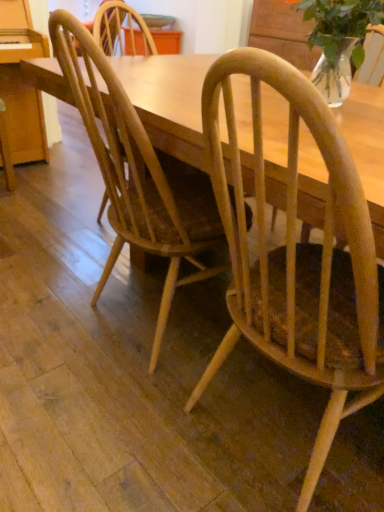
The width and height of the screenshot is (384, 512). Describe the element at coordinates (338, 41) in the screenshot. I see `clear glass vase at upper right` at that location.

I want to click on light brown wood chair at center, which is counted as the first chair, starting from the right, so click(x=298, y=256).

Consider the image. From a real-world perspective, is light brown wood chair at center, which appears as the 2th chair when viewed from the left, under natural wood chair at center, which is the 1th chair in left-to-right order?

Yes, from a real-world perspective, light brown wood chair at center, which appears as the 2th chair when viewed from the left, is under natural wood chair at center, which is the 1th chair in left-to-right order.

Where is `chair on the left of light brown wood chair at center, which appears as the 2th chair when viewed from the left`? chair on the left of light brown wood chair at center, which appears as the 2th chair when viewed from the left is located at coordinates (137, 175).

Between light brown wood chair at center, which is counted as the first chair, starting from the right, and natural wood chair at center, which is the 1th chair in left-to-right order, which one is positioned in front?

light brown wood chair at center, which is counted as the first chair, starting from the right.

From the image's perspective, is light brown wood chair at center, which is counted as the first chair, starting from the right, above or below natural wood chair at center, marked as the 2th chair in a right-to-left arrangement?

Based on their image positions, light brown wood chair at center, which is counted as the first chair, starting from the right, is located beneath natural wood chair at center, marked as the 2th chair in a right-to-left arrangement.

Does natural wood chair at center, marked as the 2th chair in a right-to-left arrangement, have a greater width compared to light brown wood chair at center, which is counted as the first chair, starting from the right?

No, natural wood chair at center, marked as the 2th chair in a right-to-left arrangement, is not wider than light brown wood chair at center, which is counted as the first chair, starting from the right.

From a real-world perspective, is natural wood chair at center, which is the 1th chair in left-to-right order, positioned under light brown wood chair at center, which appears as the 2th chair when viewed from the left, based on gravity?

No.

Is natural wood chair at center, marked as the 2th chair in a right-to-left arrangement, taller or shorter than light brown wood chair at center, which is counted as the first chair, starting from the right?

natural wood chair at center, marked as the 2th chair in a right-to-left arrangement, is shorter than light brown wood chair at center, which is counted as the first chair, starting from the right.

How many degrees apart are the facing directions of clear glass vase at upper right and light brown wood chair at center, which is counted as the first chair, starting from the right?

88.6 degrees separate the facing orientations of clear glass vase at upper right and light brown wood chair at center, which is counted as the first chair, starting from the right.

From the image's perspective, is clear glass vase at upper right below light brown wood chair at center, which appears as the 2th chair when viewed from the left?

No, from the image's perspective, clear glass vase at upper right is not below light brown wood chair at center, which appears as the 2th chair when viewed from the left.

Is clear glass vase at upper right placed right next to light brown wood chair at center, which is counted as the first chair, starting from the right?

No, clear glass vase at upper right is not with light brown wood chair at center, which is counted as the first chair, starting from the right.

Considering the relative sizes of clear glass vase at upper right and light brown wood chair at center, which appears as the 2th chair when viewed from the left, in the image provided, is clear glass vase at upper right taller than light brown wood chair at center, which appears as the 2th chair when viewed from the left,?

No.

Is light brown wood chair at center, which is counted as the first chair, starting from the right, next to clear glass vase at upper right and touching it?

light brown wood chair at center, which is counted as the first chair, starting from the right, and clear glass vase at upper right are not in contact.

Who is taller, light brown wood chair at center, which appears as the 2th chair when viewed from the left, or clear glass vase at upper right?

light brown wood chair at center, which appears as the 2th chair when viewed from the left.

Could you tell me if light brown wood chair at center, which appears as the 2th chair when viewed from the left, is turned towards clear glass vase at upper right?

No.

Does natural wood chair at center, which is the 1th chair in left-to-right order, have a lesser height compared to clear glass vase at upper right?

No, natural wood chair at center, which is the 1th chair in left-to-right order, is not shorter than clear glass vase at upper right.

In terms of size, does natural wood chair at center, which is the 1th chair in left-to-right order, appear bigger or smaller than clear glass vase at upper right?

In the image, natural wood chair at center, which is the 1th chair in left-to-right order, appears to be larger than clear glass vase at upper right.

From a real-world perspective, is natural wood chair at center, which is the 1th chair in left-to-right order, located higher than clear glass vase at upper right?

No, from a real-world perspective, natural wood chair at center, which is the 1th chair in left-to-right order, is not on top of clear glass vase at upper right.

Which point is more distant from viewer, (x=191, y=232) or (x=336, y=71)?

Point (x=191, y=232)

Can we say clear glass vase at upper right lies outside natural wood chair at center, which is the 1th chair in left-to-right order?

Answer: Indeed, clear glass vase at upper right is completely outside natural wood chair at center, which is the 1th chair in left-to-right order.

From the picture: Between clear glass vase at upper right and natural wood chair at center, which is the 1th chair in left-to-right order, which one is positioned behind?

clear glass vase at upper right is further away from the camera.

Is clear glass vase at upper right positioned far away from natural wood chair at center, marked as the 2th chair in a right-to-left arrangement?

Actually, clear glass vase at upper right and natural wood chair at center, marked as the 2th chair in a right-to-left arrangement, are a little close together.

From the image's perspective, which is above, clear glass vase at upper right or natural wood chair at center, which is the 1th chair in left-to-right order?

clear glass vase at upper right, from the image's perspective.

There is a light brown wood chair at center, which appears as the 2th chair when viewed from the left. Where is `chair above it (from a real-world perspective)`? chair above it (from a real-world perspective) is located at coordinates (137, 175).

Find the location of `chair that appears below the natural wood chair at center, marked as the 2th chair in a right-to-left arrangement (from the image's perspective)`. chair that appears below the natural wood chair at center, marked as the 2th chair in a right-to-left arrangement (from the image's perspective) is located at coordinates (298, 256).

Looking at the image, which one is located further to natural wood chair at center, marked as the 2th chair in a right-to-left arrangement, clear glass vase at upper right or light brown wood chair at center, which is counted as the first chair, starting from the right?

Based on the image, clear glass vase at upper right appears to be further to natural wood chair at center, marked as the 2th chair in a right-to-left arrangement.

When comparing their distances from clear glass vase at upper right, does natural wood chair at center, which is the 1th chair in left-to-right order, or light brown wood chair at center, which appears as the 2th chair when viewed from the left, seem further?

Among the two, natural wood chair at center, which is the 1th chair in left-to-right order, is located further to clear glass vase at upper right.

From the image, which object appears to be nearer to clear glass vase at upper right, light brown wood chair at center, which appears as the 2th chair when viewed from the left, or natural wood chair at center, marked as the 2th chair in a right-to-left arrangement?

The object closer to clear glass vase at upper right is light brown wood chair at center, which appears as the 2th chair when viewed from the left.

Looking at the image, which one is located further to light brown wood chair at center, which is counted as the first chair, starting from the right, clear glass vase at upper right or natural wood chair at center, marked as the 2th chair in a right-to-left arrangement?

Among the two, clear glass vase at upper right is located further to light brown wood chair at center, which is counted as the first chair, starting from the right.

Estimate the real-world distances between objects in this image. Which object is further from light brown wood chair at center, which is counted as the first chair, starting from the right, natural wood chair at center, marked as the 2th chair in a right-to-left arrangement, or clear glass vase at upper right?

clear glass vase at upper right.

Looking at the image, which one is located closer to natural wood chair at center, which is the 1th chair in left-to-right order, light brown wood chair at center, which is counted as the first chair, starting from the right, or clear glass vase at upper right?

Among the two, light brown wood chair at center, which is counted as the first chair, starting from the right, is located nearer to natural wood chair at center, which is the 1th chair in left-to-right order.

At what (x,y) coordinates should I click in order to perform the action: click on chair between clear glass vase at upper right and light brown wood chair at center, which is counted as the first chair, starting from the right, in the up-down direction. Please return your answer as a coordinate pair (x, y). The width and height of the screenshot is (384, 512). Looking at the image, I should click on (137, 175).